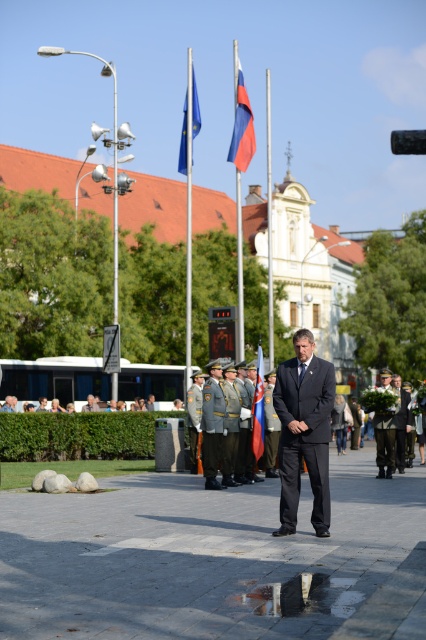
Based on the coordinates provided, which object is located at point (304,432) in the image?

The point (304,432) corresponds to the dark gray suit at center.

You are a photographer positioned at the edge of the square. You need to capture a photo that includes both the dark gray suit at center and the light brown leather jacket at center. Given that your camera has a maximum focus range of 80 feet, will you be able to include both subjects in the same frame without moving your position?

The dark gray suit at center and light brown leather jacket at center are 88.83 feet apart, which exceeds the camera maximum focus range of 80 feet. Therefore, you cannot include both subjects in the same frame without moving your position.

You are standing at the point labeled as point (89, 396) and want to walk to the point labeled as point (290, 422). According to the scene, which direction should you move to reach your destination?

You should move forward because point (290, 422) is in front of point (89, 396).